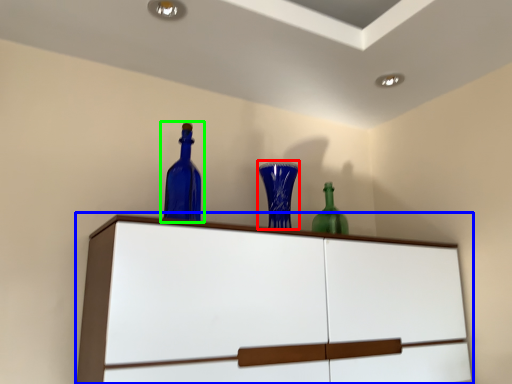
Question: Based on their relative distances, which object is nearer to glass vase (highlighted by a red box)? Choose from cupboard (highlighted by a blue box) and bottle (highlighted by a green box).

Choices:
 (A) cupboard
 (B) bottle

Answer: (B)